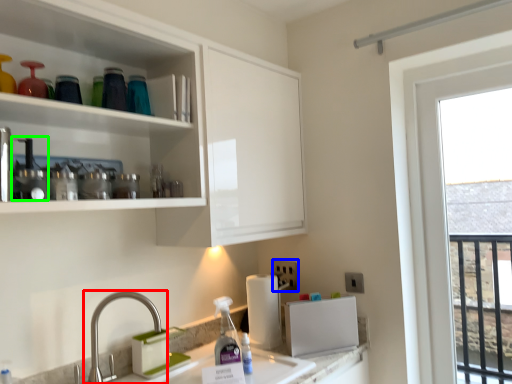
Question: Which is nearer to the tap (highlighted by a red box)? electric outlet (highlighted by a blue box) or appliance (highlighted by a green box).

Choices:
 (A) electric outlet
 (B) appliance

Answer: (B)